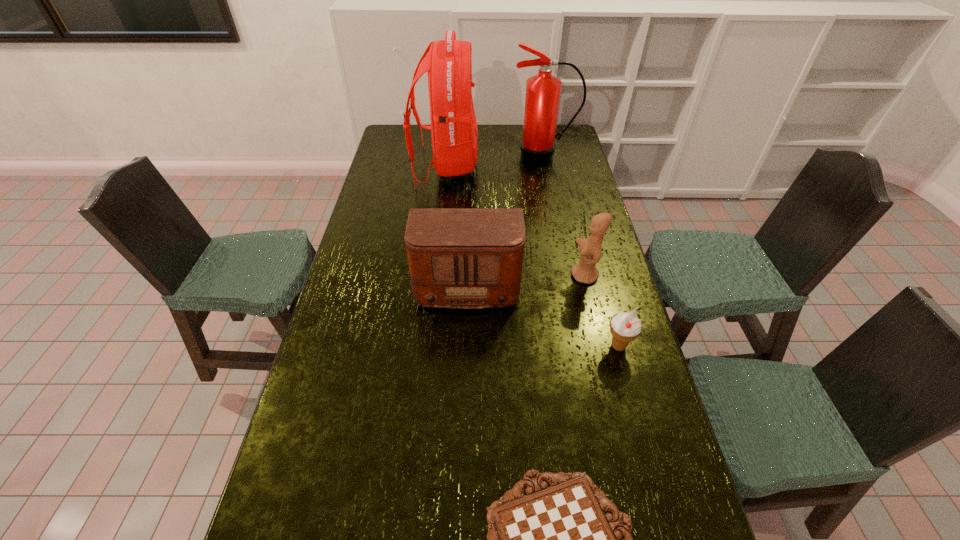
Identify the location of vacant space that satisfies the following two spatial constraints: 1. on the main compartment of the backpack; 2. on the right side of the icecream. This screenshot has width=960, height=540. (427, 346).